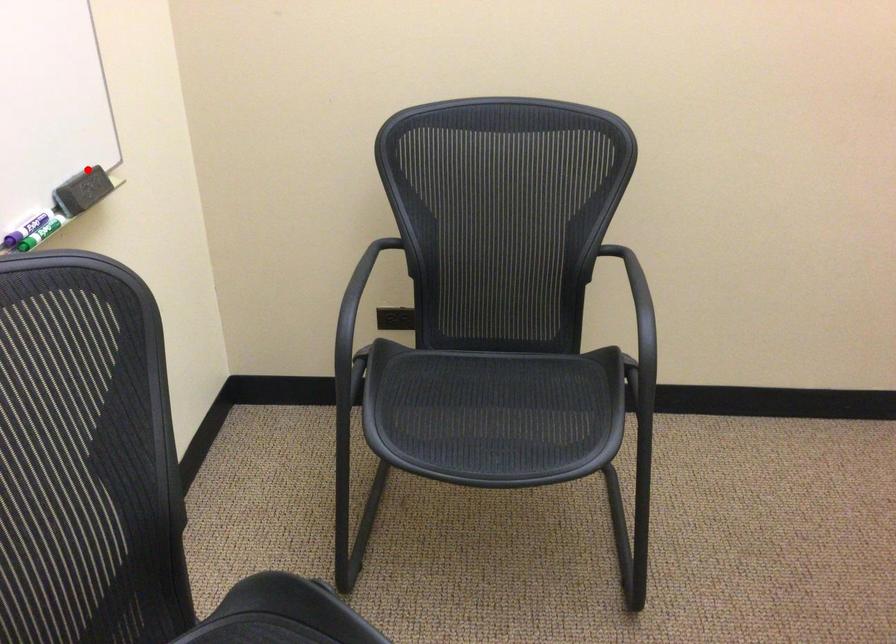
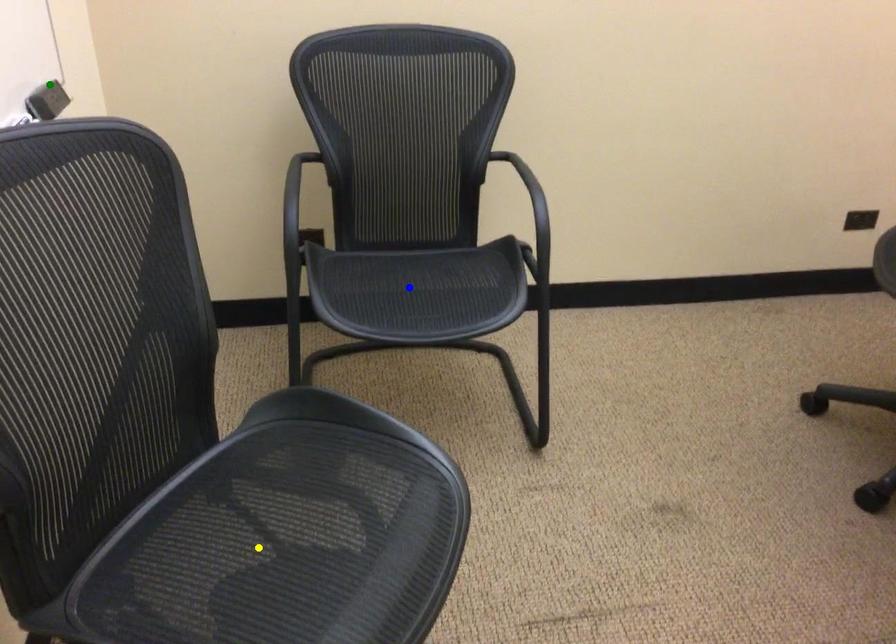
Question: I am providing you with two images of the same scene from different viewpoints. A red point is marked on the first image. You are given multiple points on the second image. In image 2, which mark is for the same physical point as the one in image 1?

Choices:
 (A) blue point
 (B) green point
 (C) yellow point

Answer: (B)